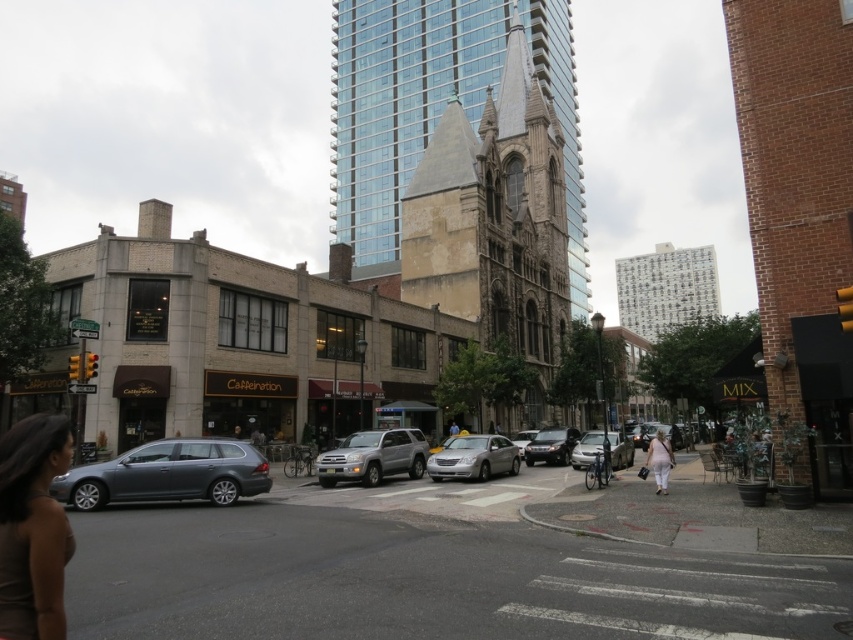
Can you confirm if white cotton dress at lower right is shorter than silver metallic sedan at center?

In fact, white cotton dress at lower right may be taller than silver metallic sedan at center.

Is white cotton dress at lower right to the left of silver metallic sedan at center from the viewer's perspective?

In fact, white cotton dress at lower right is to the right of silver metallic sedan at center.

Who is more forward, [643,465] or [537,429]?

Point [643,465] is more forward.

What are the coordinates of `white cotton dress at lower right` in the screenshot? It's located at (659, 460).

Between satin silver suv at center and silver metallic sedan at center, which one has more height?

With more height is satin silver suv at center.

Who is lower down, satin silver suv at center or silver metallic sedan at center?

Positioned lower is silver metallic sedan at center.

Who is more forward, (422, 452) or (527, 438)?

Positioned in front is point (422, 452).

Where is `satin silver suv at center`? This screenshot has height=640, width=853. satin silver suv at center is located at coordinates (373, 456).

In the scene shown: Is glassy steel tower at center to the right of shiny silver sedan at center from the viewer's perspective?

Incorrect, glassy steel tower at center is not on the right side of shiny silver sedan at center.

Who is lower down, glassy steel tower at center or shiny silver sedan at center?

shiny silver sedan at center is lower down.

Which is in front, point (524, 170) or point (531, 458)?

Point (531, 458)

Locate an element on the screen. The image size is (853, 640). glassy steel tower at center is located at coordinates (463, 163).